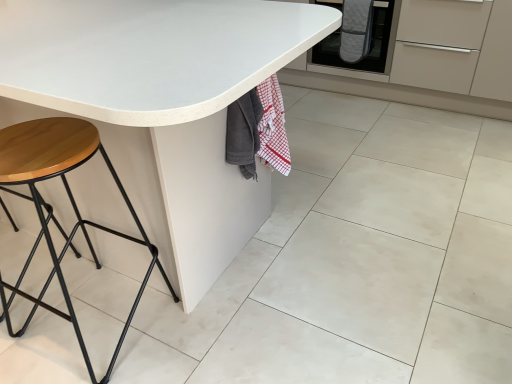
Describe the element at coordinates (355, 283) in the screenshot. I see `white matte granite at center` at that location.

Describe the element at coordinates (394, 92) in the screenshot. I see `quilted gray oven mitts at center` at that location.

Where is `gray quilted oven mitt at upper right`? gray quilted oven mitt at upper right is located at coordinates (369, 51).

Locate an element on the screen. The image size is (512, 384). wooden/matte stool at left is located at coordinates (51, 207).

From the picture: From the image's perspective, is white matte table at center above or below wooden/matte stool at left?

From the image's perspective, white matte table at center appears above wooden/matte stool at left.

Considering the relative positions of white matte table at center and wooden/matte stool at left in the image provided, is white matte table at center to the left or to the right of wooden/matte stool at left?

white matte table at center is to the left of wooden/matte stool at left.

How many degrees apart are the facing directions of white matte table at center and wooden/matte stool at left?

89.9 degrees separate the facing orientations of white matte table at center and wooden/matte stool at left.

This screenshot has width=512, height=384. What are the coordinates of `stool on the right of white matte table at center` in the screenshot? It's located at point(51,207).

From a real-world perspective, which object rests below the other?

In real-world perspective, wooden/matte stool at left is lower.

Consider the image. Considering the relative sizes of quilted gray oven mitts at center and wooden/matte stool at left in the image provided, is quilted gray oven mitts at center shorter than wooden/matte stool at left?

Incorrect, the height of quilted gray oven mitts at center does not fall short of that of wooden/matte stool at left.

Does quilted gray oven mitts at center turn towards wooden/matte stool at left?

Yes, quilted gray oven mitts at center is facing wooden/matte stool at left.

Is point (430, 104) farther from viewer compared to point (127, 239)?

Yes, point (430, 104) is farther from viewer.

Are wooden/matte stool at left and white matte table at center located far from each other?

No, wooden/matte stool at left is in close proximity to white matte table at center.

Would you say wooden/matte stool at left is outside white matte table at center?

Actually, wooden/matte stool at left is at least partially inside white matte table at center.

From the image's perspective, is wooden/matte stool at left located beneath white matte table at center?

Correct, wooden/matte stool at left appears lower than white matte table at center in the image.

How distant is gray quilted blanket at upper right from wooden/matte stool at left?

The distance of gray quilted blanket at upper right from wooden/matte stool at left is 2.08 meters.

Considering the positions of points (367, 30) and (70, 139), is point (367, 30) farther from camera compared to point (70, 139)?

Yes.

From the picture: How many degrees apart are the facing directions of gray quilted blanket at upper right and wooden/matte stool at left?

179 degrees.

Is gray quilted blanket at upper right turned away from wooden/matte stool at left?

No, wooden/matte stool at left is not at the back of gray quilted blanket at upper right.

Is point (348, 61) positioned before point (310, 0)?

No, it is behind (310, 0).

Considering the sizes of objects gray quilted blanket at upper right and gray quilted oven mitt at upper right in the image provided, who is smaller, gray quilted blanket at upper right or gray quilted oven mitt at upper right?

gray quilted blanket at upper right is smaller.

From a real-world perspective, is gray quilted blanket at upper right physically located above or below gray quilted oven mitt at upper right?

From a real-world perspective, gray quilted blanket at upper right is physically above gray quilted oven mitt at upper right.

Is gray quilted blanket at upper right closer to camera compared to gray quilted oven mitt at upper right?

No, the depth of gray quilted blanket at upper right is greater than that of gray quilted oven mitt at upper right.

This screenshot has height=384, width=512. I want to click on cabinetry on the right of gray quilted blanket at upper right, so click(394, 92).

From the image's perspective, is gray quilted blanket at upper right located above quilted gray oven mitts at center?

No, from the image's perspective, gray quilted blanket at upper right is not over quilted gray oven mitts at center.

Looking at this image, does gray quilted blanket at upper right have a larger size compared to quilted gray oven mitts at center?

No, gray quilted blanket at upper right is not bigger than quilted gray oven mitts at center.

From a real-world perspective, is gray quilted blanket at upper right located beneath quilted gray oven mitts at center?

No, from a real-world perspective, gray quilted blanket at upper right is not beneath quilted gray oven mitts at center.

How different are the orientations of wooden/matte stool at left and gray quilted oven mitt at upper right in degrees?

They differ by 180 degrees in their facing directions.

Based on the photo, is wooden/matte stool at left taller or shorter than gray quilted oven mitt at upper right?

In the image, wooden/matte stool at left appears to be taller than gray quilted oven mitt at upper right.

Which object is more forward, wooden/matte stool at left or gray quilted oven mitt at upper right?

wooden/matte stool at left is in front.

Based on the photo, is wooden/matte stool at left positioned far away from gray quilted oven mitt at upper right?

Yes, wooden/matte stool at left and gray quilted oven mitt at upper right are quite far apart.

Image resolution: width=512 pixels, height=384 pixels. I want to click on table lying above the wooden/matte stool at left (from the image's perspective), so click(x=160, y=105).

Find the location of a particular element. The width and height of the screenshot is (512, 384). cabinetry that is on the right side of wooden/matte stool at left is located at coordinates pyautogui.click(x=394, y=92).

Estimate the real-world distances between objects in this image. Which object is closer to gray quilted oven mitt at upper right, white matte table at center or quilted gray oven mitts at center?

quilted gray oven mitts at center is positioned closer to the anchor gray quilted oven mitt at upper right.

When comparing their distances from white matte table at center, does quilted gray oven mitts at center or gray quilted oven mitt at upper right seem closer?

Based on the image, gray quilted oven mitt at upper right appears to be nearer to white matte table at center.

Based on their spatial positions, is white matte granite at center or gray quilted blanket at upper right closer to quilted gray oven mitts at center?

gray quilted blanket at upper right is closer to quilted gray oven mitts at center.

Considering their positions, is wooden/matte stool at left positioned further to white matte table at center than quilted gray oven mitts at center?

quilted gray oven mitts at center is further to white matte table at center.

When comparing their distances from wooden/matte stool at left, does white matte granite at center or gray quilted oven mitt at upper right seem further?

gray quilted oven mitt at upper right is positioned further to the anchor wooden/matte stool at left.

From the image, which object appears to be farther from wooden/matte stool at left, gray quilted oven mitt at upper right or white matte table at center?

Among the two, gray quilted oven mitt at upper right is located further to wooden/matte stool at left.

Looking at the image, which one is located closer to white matte table at center, wooden/matte stool at left or gray quilted blanket at upper right?

wooden/matte stool at left is closer to white matte table at center.

Looking at the image, which one is located further to white matte granite at center, wooden/matte stool at left or white matte table at center?

wooden/matte stool at left is positioned further to the anchor white matte granite at center.

Identify the location of stool between white matte table at center and gray quilted oven mitt at upper right from front to back. (51, 207).

The height and width of the screenshot is (384, 512). Identify the location of cabinetry between wooden/matte stool at left and gray quilted blanket at upper right along the z-axis. (394, 92).

Where is `blanket that lies between quilted gray oven mitts at center and white matte granite at center from top to bottom`? Image resolution: width=512 pixels, height=384 pixels. blanket that lies between quilted gray oven mitts at center and white matte granite at center from top to bottom is located at coordinates (355, 30).

Identify the location of oven located between white matte table at center and gray quilted blanket at upper right in the depth direction. The width and height of the screenshot is (512, 384). (369, 51).